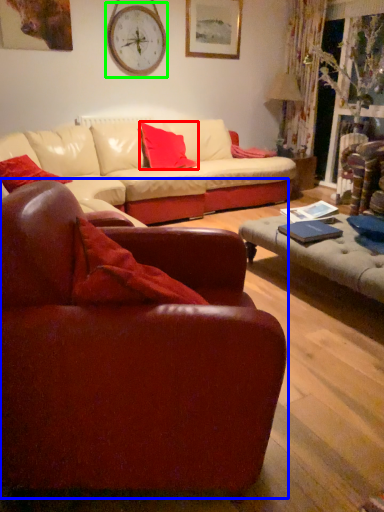
Question: Considering the real-world distances, which object is closest to pillow (highlighted by a red box)? studio couch (highlighted by a blue box) or clock (highlighted by a green box).

Choices:
 (A) studio couch
 (B) clock

Answer: (B)